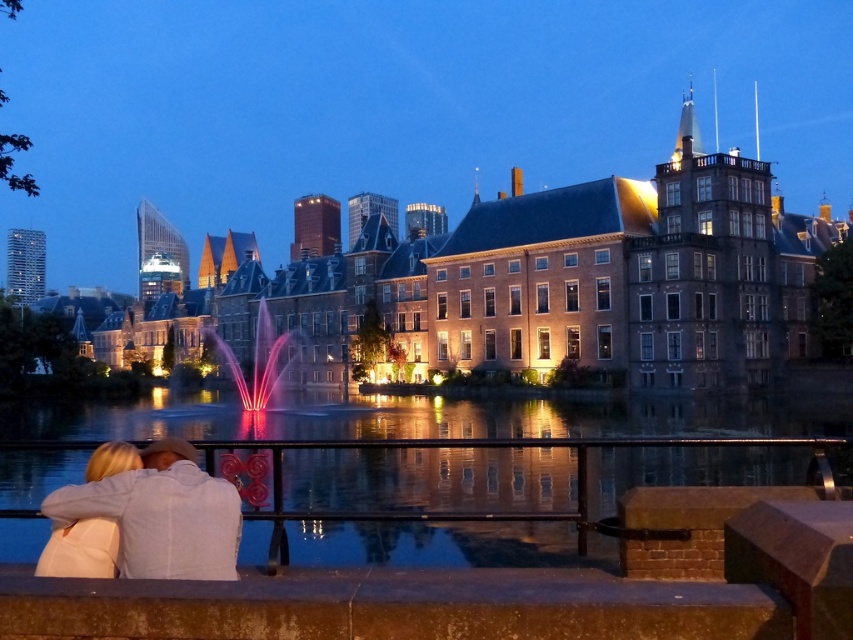
Question: Does light beige sweater at lower left appear under translucent glass fountain at center?

Choices:
 (A) yes
 (B) no

Answer: (A)

Question: Among these objects, which one is nearest to the camera?

Choices:
 (A) reflective glass water at lower center
 (B) light beige sweater at lower left
 (C) blonde hair at lower left

Answer: (B)

Question: Can you confirm if reflective glass water at lower center is wider than blonde hair at lower left?

Choices:
 (A) yes
 (B) no

Answer: (A)

Question: Which point is closer to the camera?

Choices:
 (A) (135, 413)
 (B) (265, 380)
 (C) (90, 576)

Answer: (C)

Question: Does light beige sweater at lower left appear under blonde hair at lower left?

Choices:
 (A) no
 (B) yes

Answer: (A)

Question: Which point is closer to the camera taking this photo?

Choices:
 (A) (49, 538)
 (B) (274, 340)

Answer: (A)